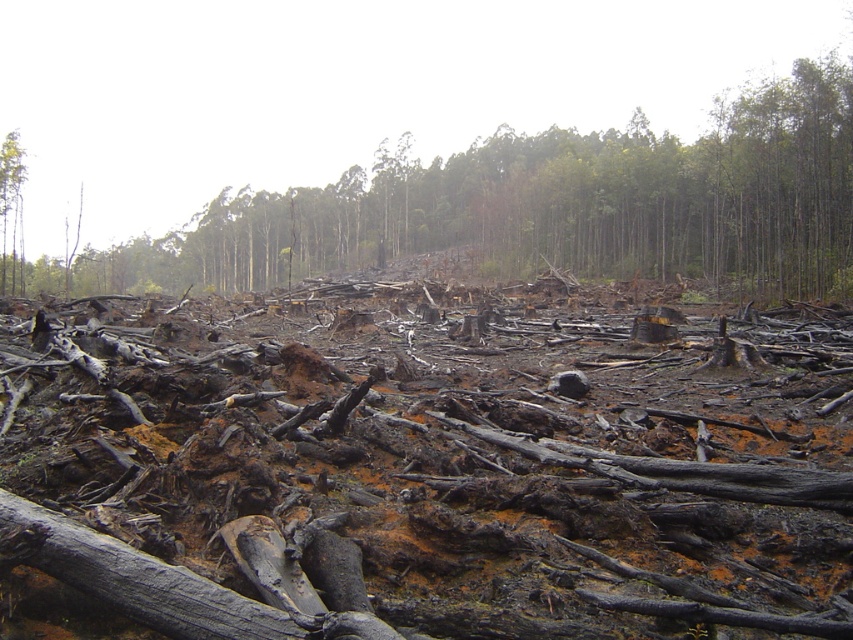
You are standing at the edge of a deforested area and want to reach a specific point marked as point [578,100]. Given that you can walk 100 meters in 5 minutes, how long will it take you to reach that point?

The distance between you and point [578,100] is 197.03 meters. At a walking speed of 100 meters per 5 minutes, it would take approximately 10 minutes to cover 200 meters. Therefore, reaching point [578,100] would take roughly 10 minutes.

You are a forest ranger who just arrived at the deforested area. You need to locate the charcoal wood debris at center to collect evidence. According to the map coordinates provided, where exactly should you go to find it?

The charcoal wood debris at center is located at point (413,170), so you should go there to collect evidence.

You are a drone operator tasked with surveying the deforested area. You notice two points marked in the image. From your vantage point above, which point is closer to you? The options are point (683, 220) and point (9, 195).

Point (9, 195) is closer to you because the description states that point (683, 220) is behind point (9, 195).